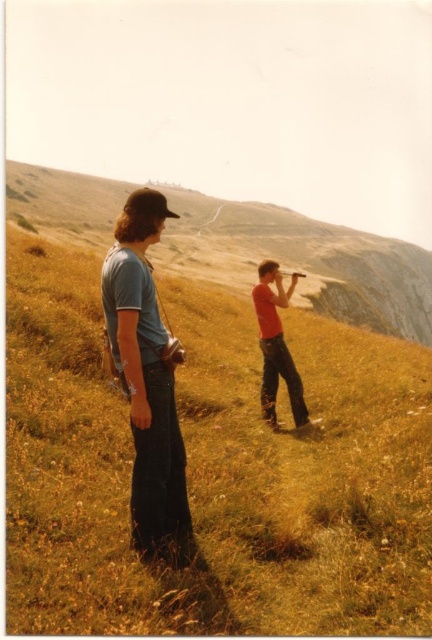
Is yellow grass at center smaller than matte red shirt at center?

No.

Does yellow grass at center have a greater height compared to matte red shirt at center?

Correct, yellow grass at center is much taller as matte red shirt at center.

Is point (310, 284) positioned behind point (304, 420)?

Yes, it is.

What are the coordinates of `yellow grass at center` in the screenshot? It's located at (302, 260).

Is yellow grassy at center thinner than matte red shirt at center?

In fact, yellow grassy at center might be wider than matte red shirt at center.

Can you confirm if yellow grassy at center is wider than matte red shirt at center?

Yes, yellow grassy at center is wider than matte red shirt at center.

Where is `yellow grassy at center`? yellow grassy at center is located at coordinates pyautogui.click(x=212, y=468).

This screenshot has width=432, height=640. I want to click on yellow grassy at center, so click(x=212, y=468).

Is yellow grass at center positioned behind denim jeans at center?

Yes, yellow grass at center is further from the viewer.

Is yellow grass at center to the left of denim jeans at center from the viewer's perspective?

Correct, you'll find yellow grass at center to the left of denim jeans at center.

Between point (184, 237) and point (155, 460), which one is positioned in front?

Point (155, 460) is more forward.

Locate an element on the screen. yellow grass at center is located at coordinates (302, 260).